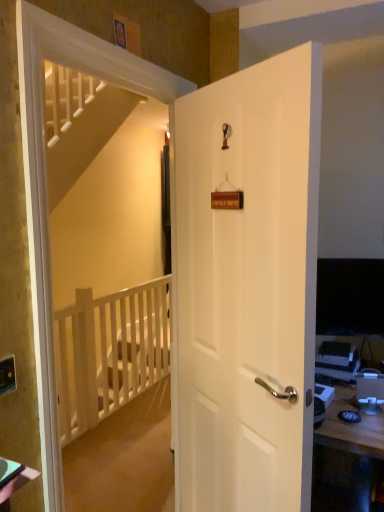
Question: Is matte black desktop computer at right taller or shorter than white wooden balustrade at left?

Choices:
 (A) tall
 (B) short

Answer: (B)

Question: In the image, is matte black desktop computer at right positioned in front of or behind white wooden balustrade at left?

Choices:
 (A) behind
 (B) front

Answer: (B)

Question: Which object is the closest to the matte black desktop computer at right?

Choices:
 (A) white matte door at center
 (B) white wooden balustrade at left
 (C) matte black outlet at lower left

Answer: (A)

Question: Considering the real-world distances, which object is farthest from the white matte door at center?

Choices:
 (A) matte black outlet at lower left
 (B) matte black desktop computer at right
 (C) white wooden balustrade at left

Answer: (C)